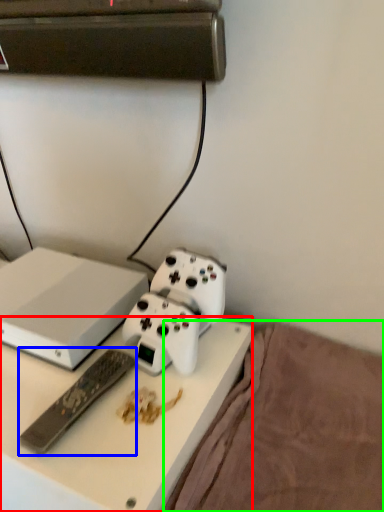
Question: Based on their relative distances, which object is farther from desk (highlighted by a red box)? Choose from remote control (highlighted by a blue box) and bedding (highlighted by a green box).

Choices:
 (A) remote control
 (B) bedding

Answer: (B)